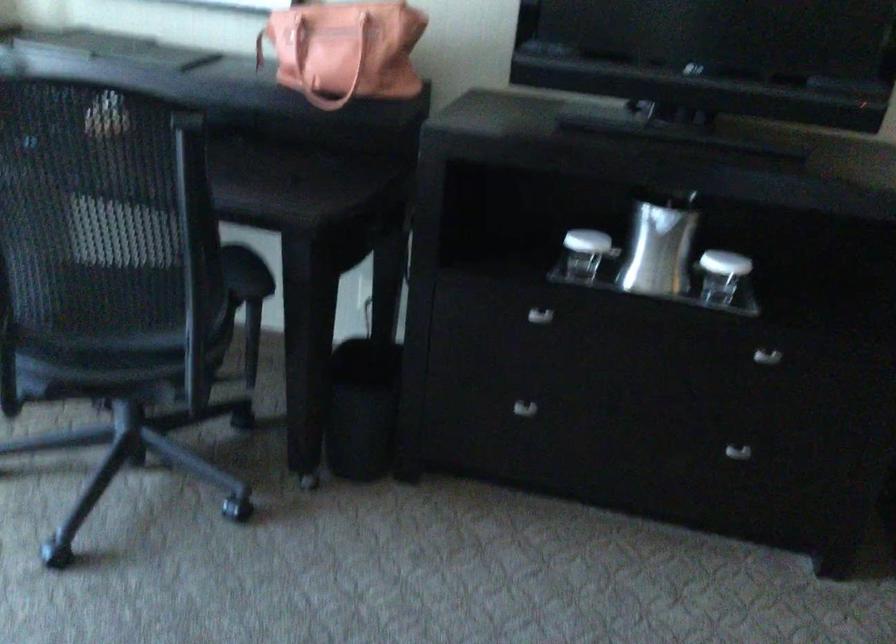
Where would you sit the chair sitting surface? Please return your answer as a coordinate pair (x, y).

(107, 265)